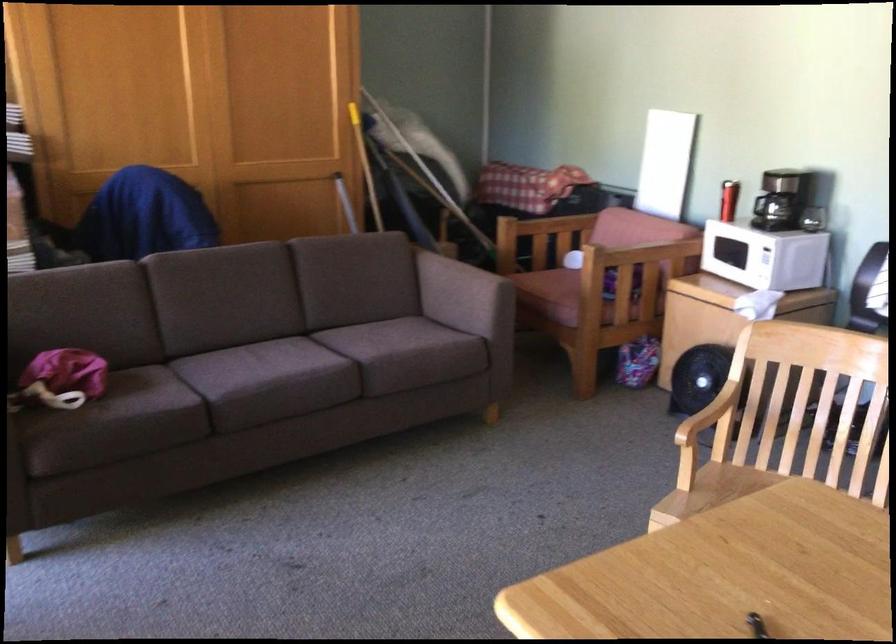
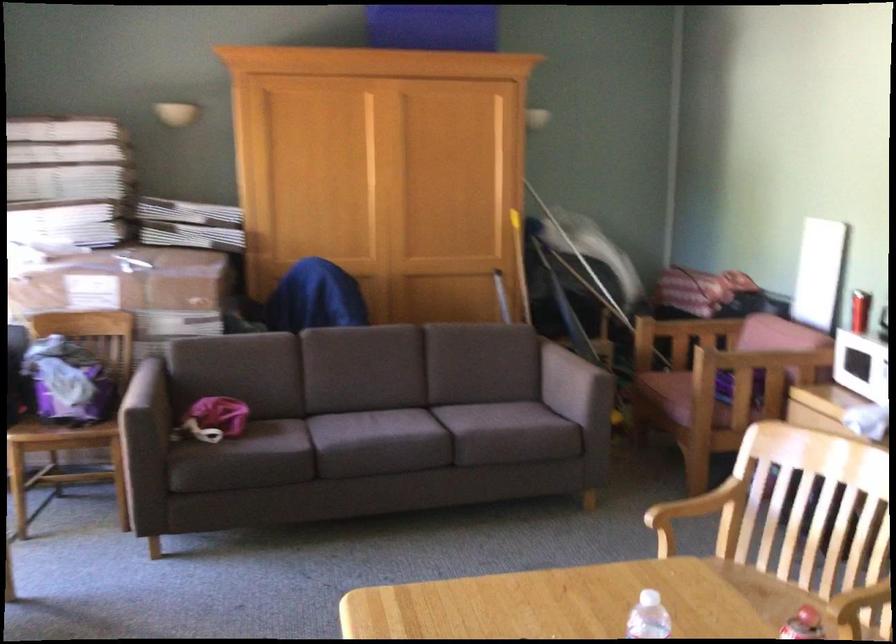
Where in the second image is the point corresponding to the point at 682,549 from the first image?

(555, 603)